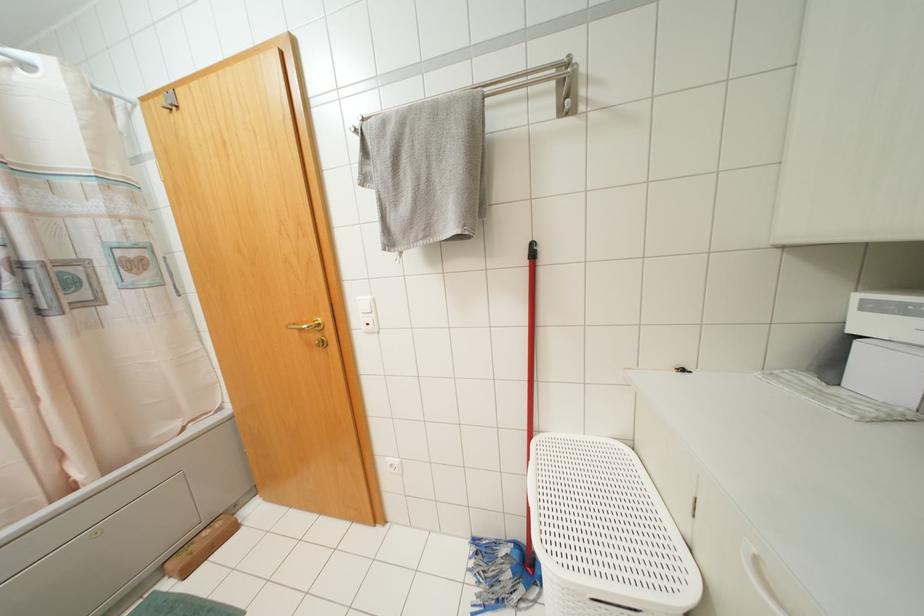
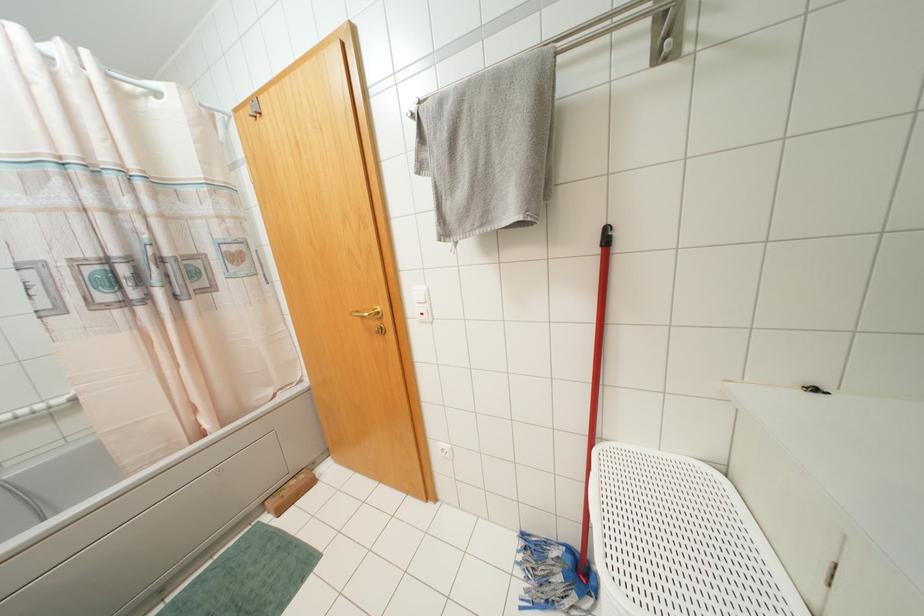
Find the pixel in the second image that matches [424,237] in the first image.

(481, 225)